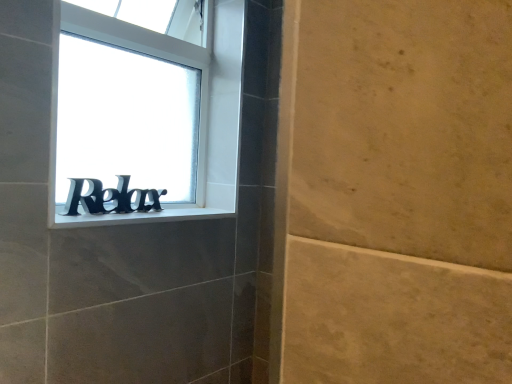
Question: Based on their sizes in the image, would you say white plastic window sill at center is bigger or smaller than black metallic letters at center?

Choices:
 (A) small
 (B) big

Answer: (A)

Question: Which is correct: white plastic window sill at center is inside black metallic letters at center, or outside of it?

Choices:
 (A) inside
 (B) outside

Answer: (B)

Question: Which of these objects is positioned farthest from the black plastic sign at lower left?

Choices:
 (A) white plastic window sill at center
 (B) black metallic letters at center

Answer: (A)

Question: Which is nearer to the black plastic sign at lower left?

Choices:
 (A) black metallic letters at center
 (B) white plastic window sill at center

Answer: (A)